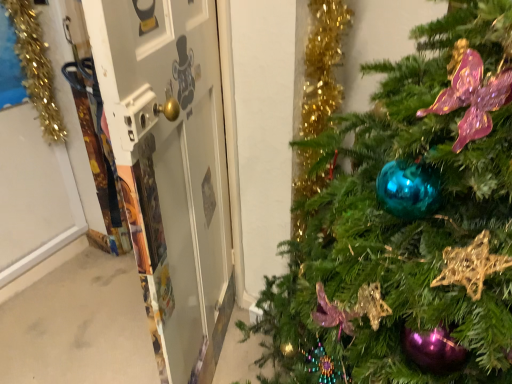
This screenshot has height=384, width=512. What do you see at coordinates (170, 168) in the screenshot?
I see `metallic gold screen door at left` at bounding box center [170, 168].

The width and height of the screenshot is (512, 384). What do you see at coordinates (407, 224) in the screenshot?
I see `shiny teal ornament at center-right` at bounding box center [407, 224].

Describe the element at coordinates (36, 68) in the screenshot. I see `gold tinsel garland at left` at that location.

Identify the location of metallic gold screen door at left. (170, 168).

I want to click on christmas tree on the right side of metallic gold screen door at left, so click(x=407, y=224).

Consider the image. Is shiny teal ornament at center-right wider or thinner than metallic gold screen door at left?

Clearly, shiny teal ornament at center-right has more width compared to metallic gold screen door at left.

Which of these two, shiny teal ornament at center-right or metallic gold screen door at left, stands shorter?

With less height is shiny teal ornament at center-right.

Which is in front, point (189, 249) or point (25, 69)?

The point (189, 249) is in front.

Consider the image. In terms of width, does metallic gold screen door at left look wider or thinner when compared to gold tinsel garland at left?

In the image, metallic gold screen door at left appears to be wider than gold tinsel garland at left.

Which of these two, metallic gold screen door at left or gold tinsel garland at left, stands shorter?

With less height is gold tinsel garland at left.

Can you tell me how much metallic gold screen door at left and gold tinsel garland at left differ in facing direction?

There is a 90.2-degree angle between the facing directions of metallic gold screen door at left and gold tinsel garland at left.

Based on their positions, is gold tinsel garland at left located to the left or right of metallic gold screen door at left?

In the image, gold tinsel garland at left appears on the left side of metallic gold screen door at left.

Is gold tinsel garland at left oriented away from metallic gold screen door at left?

gold tinsel garland at left does not have its back to metallic gold screen door at left.

From a real-world perspective, is gold tinsel garland at left positioned above or below metallic gold screen door at left?

Clearly, from a real-world perspective, gold tinsel garland at left is above metallic gold screen door at left.

Is shiny teal ornament at center-right to the right of gold tinsel garland at left from the viewer's perspective?

Correct, you'll find shiny teal ornament at center-right to the right of gold tinsel garland at left.

I want to click on christmas decoration behind the shiny teal ornament at center-right, so click(36, 68).

Is point (456, 137) positioned behind point (11, 15)?

That is False.

Is metallic gold screen door at left looking in the opposite direction of shiny teal ornament at center-right?

metallic gold screen door at left does not have its back to shiny teal ornament at center-right.

Between metallic gold screen door at left and shiny teal ornament at center-right, which one has less height?

Standing shorter between the two is shiny teal ornament at center-right.

You are a GUI agent. You are given a task and a screenshot of the screen. Output one action in this format:
    pyautogui.click(x=<x>, y=<y>)
    Task: Click on the christmas tree positioned vertically above the metallic gold screen door at left (from a real-world perspective)
    
    Given the screenshot: What is the action you would take?
    pyautogui.click(x=407, y=224)

Considering the relative sizes of metallic gold screen door at left and shiny teal ornament at center-right in the image provided, is metallic gold screen door at left thinner than shiny teal ornament at center-right?

Indeed, metallic gold screen door at left has a lesser width compared to shiny teal ornament at center-right.

In terms of height, does gold tinsel garland at left look taller or shorter compared to shiny teal ornament at center-right?

gold tinsel garland at left is shorter than shiny teal ornament at center-right.

Is gold tinsel garland at left oriented away from shiny teal ornament at center-right?

No, gold tinsel garland at left is not facing away from shiny teal ornament at center-right.

Does point (40, 61) lie behind point (340, 379)?

Yes.

At what (x,y) coordinates should I click in order to perform the action: click on screen door that appears behind the shiny teal ornament at center-right. Please return your answer as a coordinate pair (x, y). This screenshot has width=512, height=384. Looking at the image, I should click on (170, 168).

Locate an element on the screen. The width and height of the screenshot is (512, 384). screen door below the gold tinsel garland at left (from the image's perspective) is located at coordinates (170, 168).

Looking at the image, which one is located further to gold tinsel garland at left, metallic gold screen door at left or shiny teal ornament at center-right?

shiny teal ornament at center-right lies further to gold tinsel garland at left than the other object.

From the image, which object appears to be farther from metallic gold screen door at left, shiny teal ornament at center-right or gold tinsel garland at left?

Based on the image, gold tinsel garland at left appears to be further to metallic gold screen door at left.

Estimate the real-world distances between objects in this image. Which object is closer to gold tinsel garland at left, shiny teal ornament at center-right or metallic gold screen door at left?

The object closer to gold tinsel garland at left is metallic gold screen door at left.

Considering their positions, is gold tinsel garland at left positioned closer to shiny teal ornament at center-right than metallic gold screen door at left?

Based on the image, metallic gold screen door at left appears to be nearer to shiny teal ornament at center-right.

Looking at this image, considering their positions, is metallic gold screen door at left positioned closer to shiny teal ornament at center-right than gold tinsel garland at left?

Based on the image, metallic gold screen door at left appears to be nearer to shiny teal ornament at center-right.

Based on their spatial positions, is gold tinsel garland at left or shiny teal ornament at center-right closer to metallic gold screen door at left?

shiny teal ornament at center-right lies closer to metallic gold screen door at left than the other object.

Image resolution: width=512 pixels, height=384 pixels. Identify the location of screen door between gold tinsel garland at left and shiny teal ornament at center-right. (170, 168).